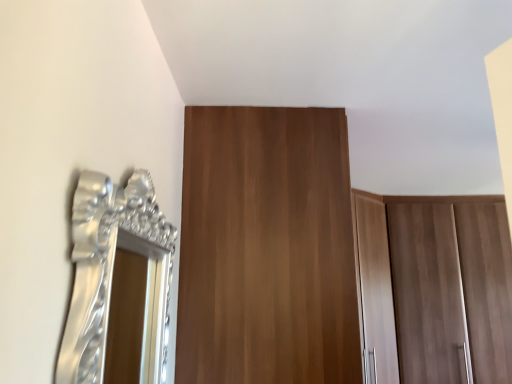
Question: Considering the positions of point (220, 223) and point (94, 279), is point (220, 223) closer or farther from the camera than point (94, 279)?

Choices:
 (A) closer
 (B) farther

Answer: (B)

Question: In terms of height, does brown wood door at upper center look taller or shorter compared to silver metallic mirror at left?

Choices:
 (A) short
 (B) tall

Answer: (B)

Question: Is brown wood door at upper center inside or outside of silver metallic mirror at left?

Choices:
 (A) outside
 (B) inside

Answer: (A)

Question: Considering their positions, is silver metallic mirror at left located in front of or behind brown wood door at upper center?

Choices:
 (A) behind
 (B) front

Answer: (B)

Question: Is silver metallic mirror at left spatially inside brown wood door at upper center, or outside of it?

Choices:
 (A) outside
 (B) inside

Answer: (A)

Question: Based on their positions, is silver metallic mirror at left located to the left or right of brown wood door at upper center?

Choices:
 (A) right
 (B) left

Answer: (B)

Question: Looking at their shapes, would you say silver metallic mirror at left is wider or thinner than brown wood door at upper center?

Choices:
 (A) wide
 (B) thin

Answer: (B)